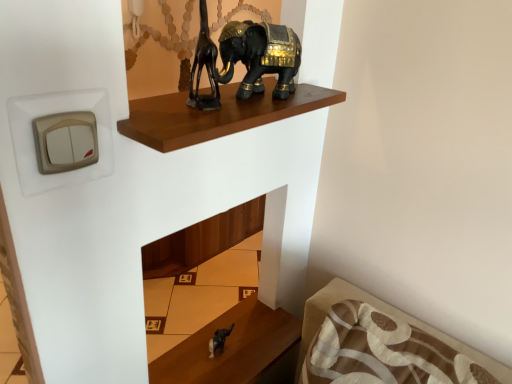
Question: Is satin black elephant at lower center closer to camera compared to black glossy elephant at upper center?

Choices:
 (A) yes
 (B) no

Answer: (B)

Question: Are satin black elephant at lower center and black glossy elephant at upper center making contact?

Choices:
 (A) yes
 (B) no

Answer: (B)

Question: From the image's perspective, would you say satin black elephant at lower center is shown under black glossy elephant at upper center?

Choices:
 (A) no
 (B) yes

Answer: (B)

Question: Is satin black elephant at lower center aimed at black glossy elephant at upper center?

Choices:
 (A) no
 (B) yes

Answer: (A)

Question: Is satin black elephant at lower center behind black glossy elephant at upper center?

Choices:
 (A) no
 (B) yes

Answer: (B)

Question: Does point (323, 102) appear closer or farther from the camera than point (290, 69)?

Choices:
 (A) farther
 (B) closer

Answer: (A)

Question: Do you think brown polished wood shelf at upper center is within black glossy elephant at upper center, or outside of it?

Choices:
 (A) outside
 (B) inside

Answer: (A)

Question: From the image's perspective, is brown polished wood shelf at upper center positioned above or below black glossy elephant at upper center?

Choices:
 (A) above
 (B) below

Answer: (B)

Question: Is brown polished wood shelf at upper center in front of or behind black glossy elephant at upper center in the image?

Choices:
 (A) behind
 (B) front

Answer: (B)

Question: From a real-world perspective, is satin black elephant at lower center physically located above or below brown polished wood shelf at upper center?

Choices:
 (A) below
 (B) above

Answer: (A)

Question: From their relative heights in the image, would you say satin black elephant at lower center is taller or shorter than brown polished wood shelf at upper center?

Choices:
 (A) tall
 (B) short

Answer: (A)

Question: Is point (207, 370) closer or farther from the camera than point (330, 97)?

Choices:
 (A) farther
 (B) closer

Answer: (A)

Question: In terms of size, does satin black elephant at lower center appear bigger or smaller than brown polished wood shelf at upper center?

Choices:
 (A) small
 (B) big

Answer: (B)

Question: Considering the positions of satin black elephant at lower center and black glossy elephant at upper center in the image, is satin black elephant at lower center taller or shorter than black glossy elephant at upper center?

Choices:
 (A) tall
 (B) short

Answer: (B)

Question: Visually, is satin black elephant at lower center positioned to the left or to the right of black glossy elephant at upper center?

Choices:
 (A) left
 (B) right

Answer: (A)